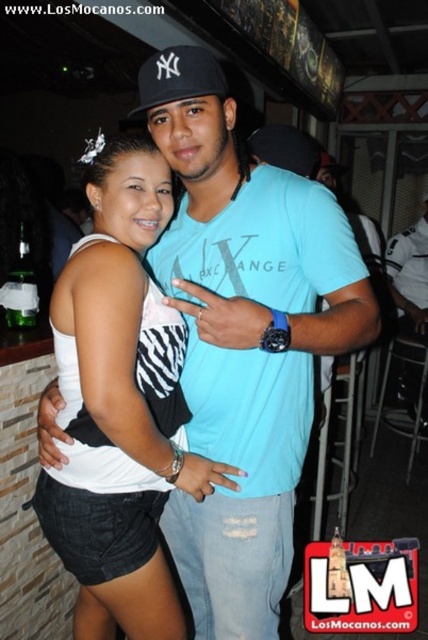
Is white denim shorts at center smaller than black fabric baseball cap at upper center?

No, white denim shorts at center is not smaller than black fabric baseball cap at upper center.

Between point (184, 476) and point (204, 67), which one is positioned behind?

The point (184, 476) is behind.

Identify the location of white denim shorts at center. (125, 314).